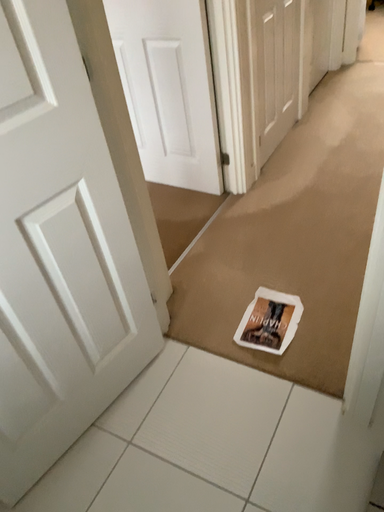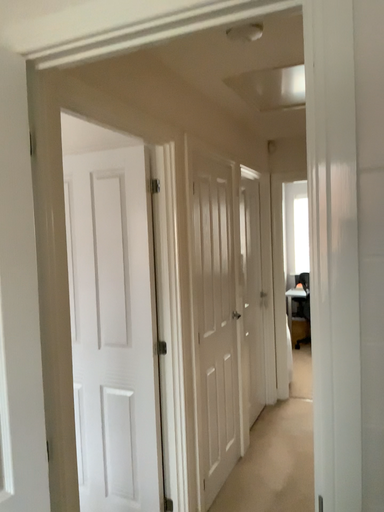
Question: How did the camera likely rotate when shooting the video?

Choices:
 (A) rotated left
 (B) rotated right

Answer: (B)